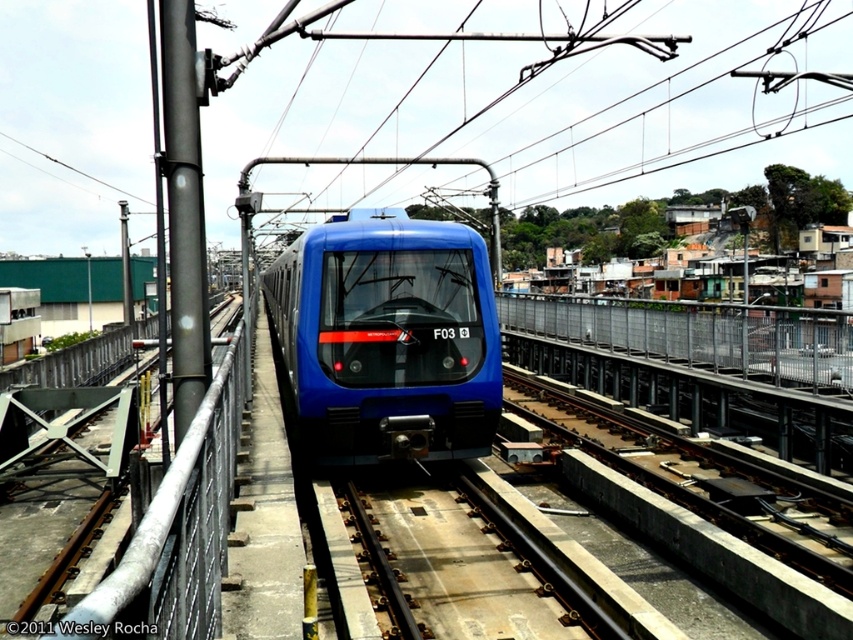
You are a passenger on the blue glossy train at center and want to see the brown metallic train track at center from your seat. Can you see it directly in front of the train?

The brown metallic train track at center is behind the blue glossy train at center, so you cannot see it directly in front of the train.

You are standing on the platform and looking at the train. There are two points marked on the train. Which point is closer to you, point (x=413, y=388) or point (x=514, y=602)?

Point (x=514, y=602) is closer to you because it is less further to the camera than point (x=413, y=388).